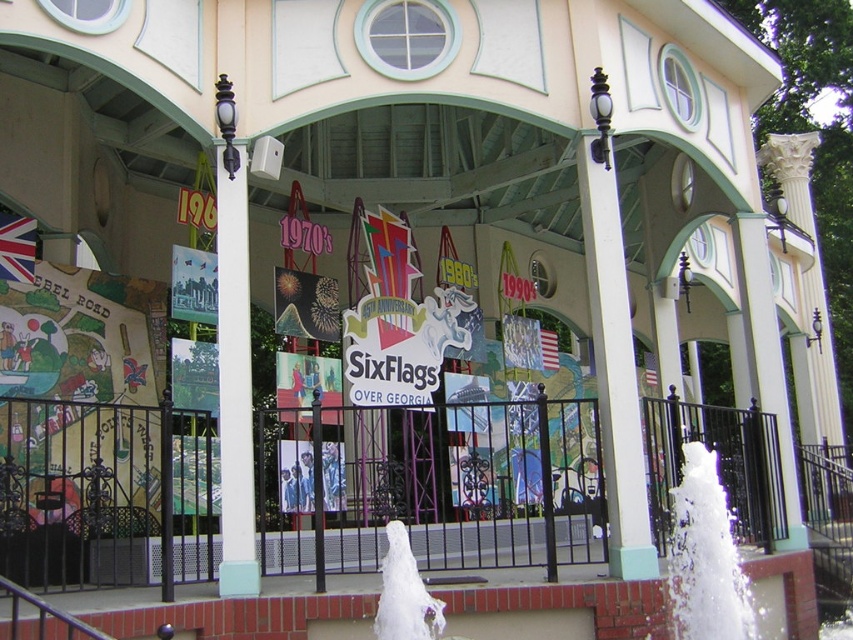
Is point (732, 467) closer to viewer compared to point (393, 625)?

No, (732, 467) is behind (393, 625).

The width and height of the screenshot is (853, 640). What do you see at coordinates (440, 490) in the screenshot?
I see `white matte fountain at center` at bounding box center [440, 490].

Identify the location of white matte fountain at center. (440, 490).

Describe the element at coordinates (440, 490) in the screenshot. Image resolution: width=853 pixels, height=640 pixels. I see `white matte fountain at center` at that location.

Which is in front, point (422, 566) or point (680, 547)?

Positioned in front is point (680, 547).

At what (x,y) coordinates should I click in order to perform the action: click on white matte fountain at center. Please return your answer as a coordinate pair (x, y). This screenshot has width=853, height=640. Looking at the image, I should click on (440, 490).

Is white frothy water at lower right positioned behind white frothy water at lower center?

Yes.

Is point (740, 596) less distant than point (395, 600)?

That is False.

The height and width of the screenshot is (640, 853). I want to click on white frothy water at lower right, so click(705, 556).